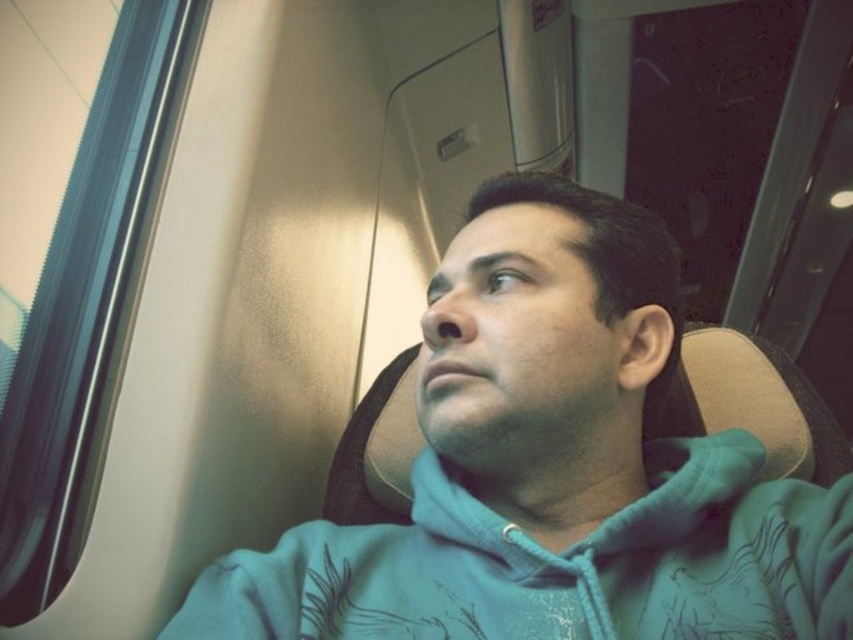
Is teal hoodie at center positioned in front of teal fleece sweatshirt at center?

Yes.

What do you see at coordinates (553, 468) in the screenshot? This screenshot has height=640, width=853. I see `teal hoodie at center` at bounding box center [553, 468].

This screenshot has height=640, width=853. Find the location of `teal hoodie at center`. teal hoodie at center is located at coordinates (553, 468).